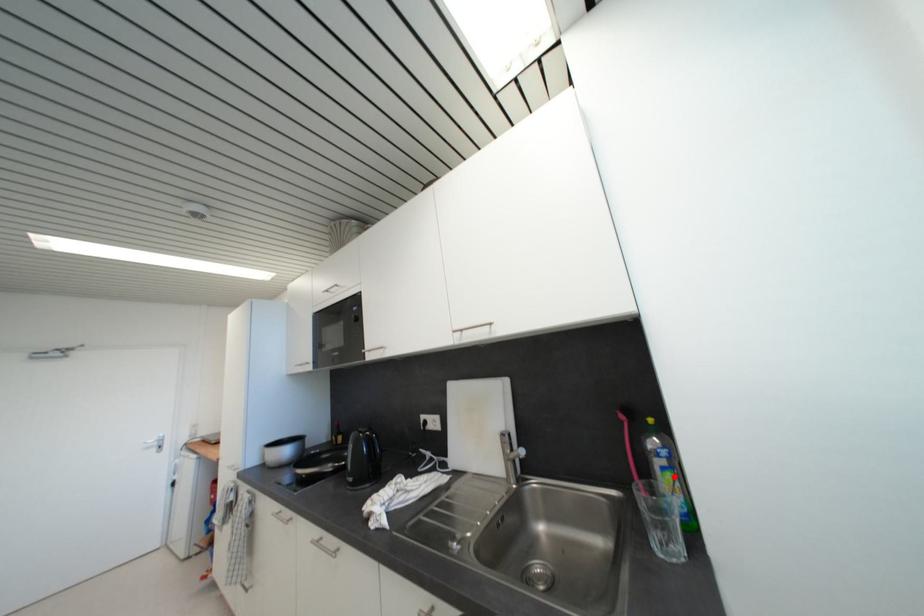
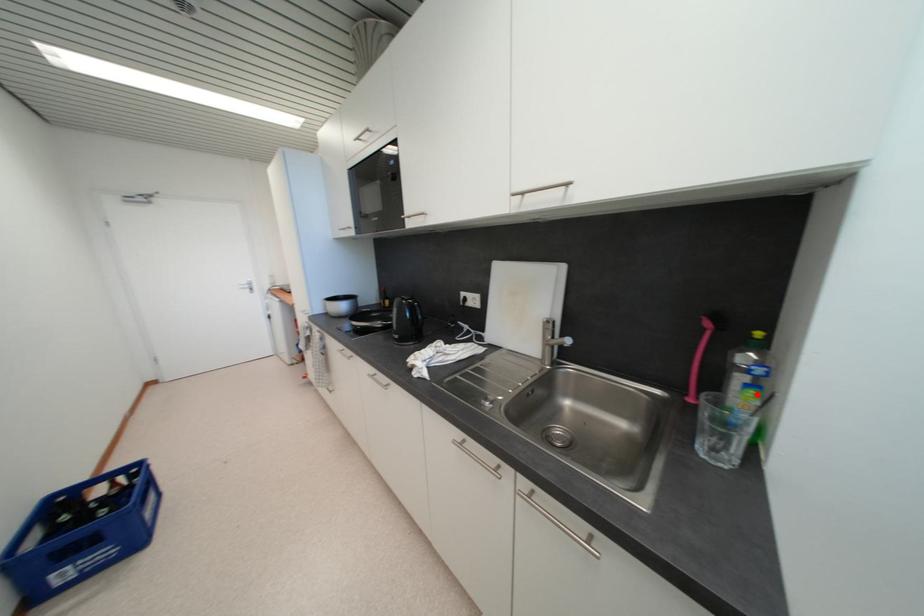
I am providing you with two images of the same scene from different viewpoints. A red point is marked on the first image and another point is marked on the second image. Are the points marked in image1 and image2 representing the same 3D position?

Yes